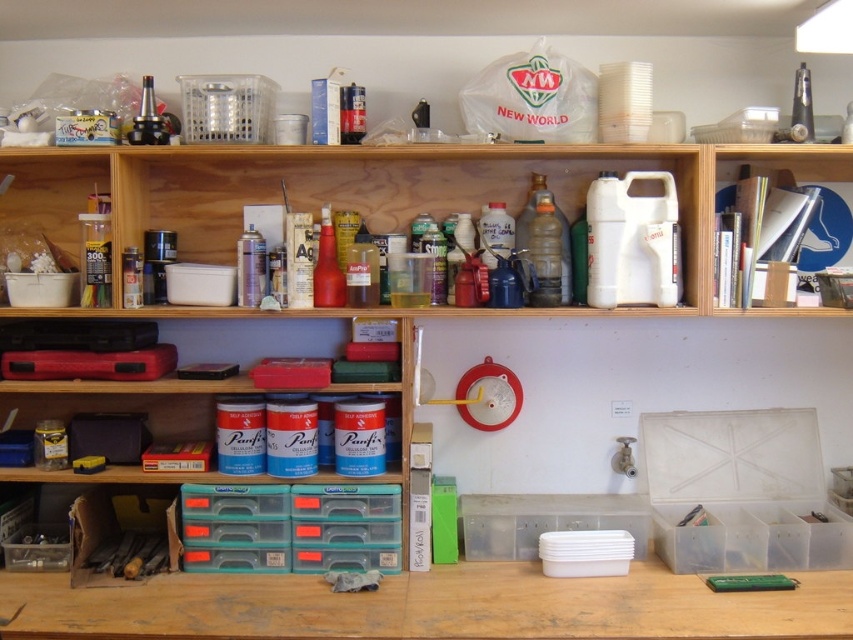
Question: Does matte plastic container at left appear under matte red spray can at center?

Choices:
 (A) yes
 (B) no

Answer: (B)

Question: Among these points, which one is farthest from the camera?

Choices:
 (A) (370, 595)
 (B) (724, 157)

Answer: (B)

Question: Can you confirm if matte plastic shelf at center is positioned to the left of wooden at lower center?

Choices:
 (A) no
 (B) yes

Answer: (A)

Question: Does blue plastic canisters at center appear under matte red spray can at center?

Choices:
 (A) no
 (B) yes

Answer: (B)

Question: Which point is farther to the camera?

Choices:
 (A) (323, 241)
 (B) (814, 161)

Answer: (B)

Question: Which of the following is the farthest from the observer?

Choices:
 (A) matte plastic shelf at center
 (B) blue plastic canisters at center

Answer: (B)